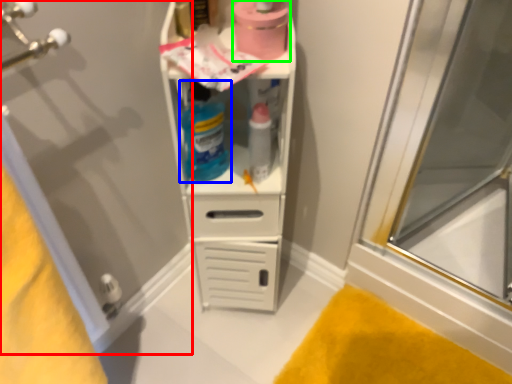
Question: Which object is positioned closest to screen door (highlighted by a red box)? Select from cleaning product (highlighted by a blue box) and toilet paper (highlighted by a green box).

Choices:
 (A) cleaning product
 (B) toilet paper

Answer: (A)